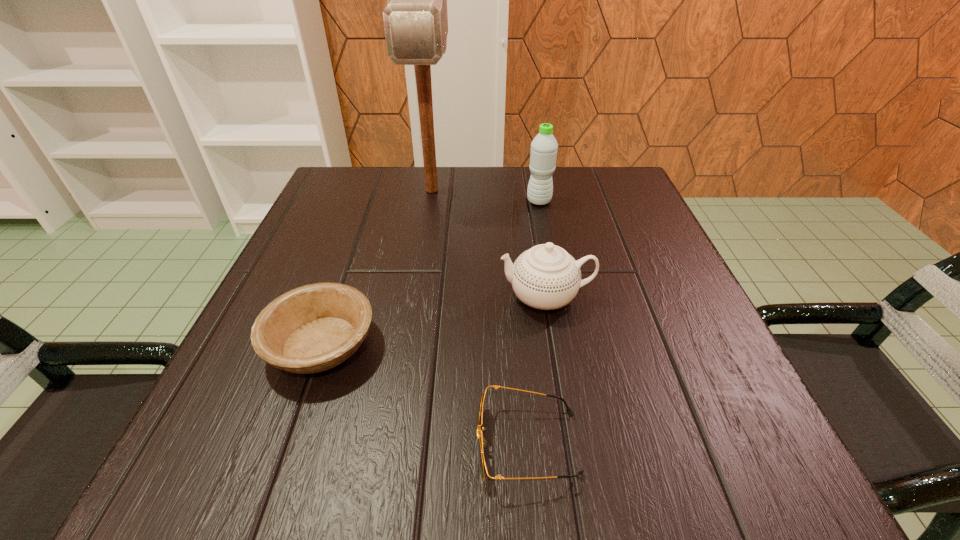
The height and width of the screenshot is (540, 960). I want to click on the second object from left to right, so click(x=415, y=20).

Identify the location of mallet. (415, 20).

The height and width of the screenshot is (540, 960). I want to click on water bottle, so click(544, 146).

Where is `the third shortest object`? The width and height of the screenshot is (960, 540). the third shortest object is located at coordinates (546, 277).

Locate an element on the screen. The image size is (960, 540). bowl is located at coordinates (313, 328).

Identify the location of the fourth tallest object. The image size is (960, 540). (313, 328).

Where is `the shortest object`? the shortest object is located at coordinates (482, 443).

Where is `the nearest object`? The width and height of the screenshot is (960, 540). the nearest object is located at coordinates click(482, 443).

The height and width of the screenshot is (540, 960). I want to click on blank area located on the striking face of the second object from left to right, so click(422, 250).

What are the coordinates of `vacant space located on the back of the second tallest object` in the screenshot? It's located at (536, 184).